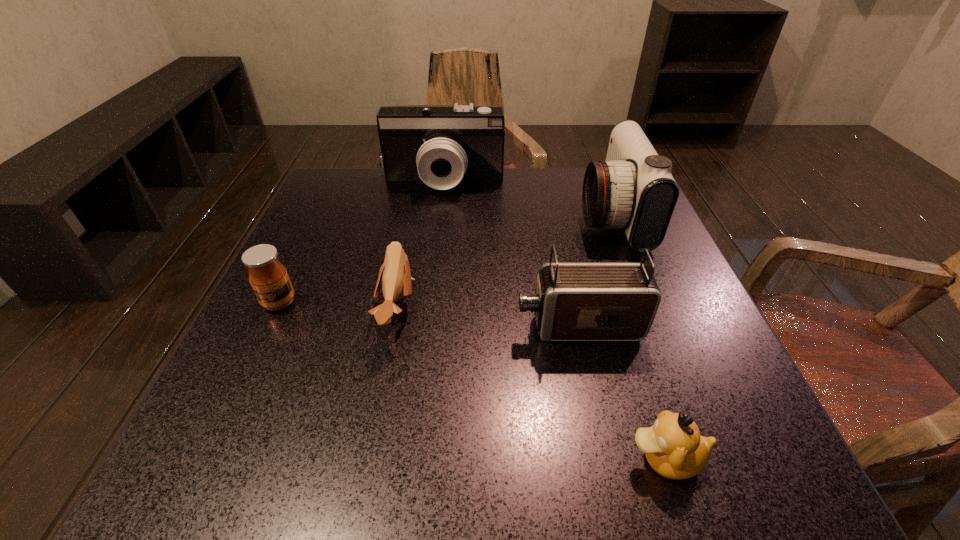
The height and width of the screenshot is (540, 960). Find the location of `object at the near right corner`. object at the near right corner is located at coordinates (673, 446).

Find the location of a particular element. vacant space at the far edge of the desktop is located at coordinates (474, 211).

Locate an element on the screen. The image size is (960, 540). free location at the near edge of the desktop is located at coordinates (627, 455).

The image size is (960, 540). I want to click on free space at the left edge of the desktop, so click(293, 283).

Find the location of `vacant region at the right edge of the desktop`. vacant region at the right edge of the desktop is located at coordinates (647, 363).

Locate an element on the screen. The height and width of the screenshot is (540, 960). free region at the far left corner is located at coordinates (370, 178).

Where is `free point at the near right corner`? This screenshot has width=960, height=540. free point at the near right corner is located at coordinates (720, 433).

Find the location of a particular element. This screenshot has width=960, height=540. free space that is in between the nearest camcorder and the bird is located at coordinates (489, 318).

At what (x,y) coordinates should I click in order to perform the action: click on empty space between the nearest object and the bird. Please return your answer as a coordinate pair (x, y). The width and height of the screenshot is (960, 540). Looking at the image, I should click on (531, 384).

In order to click on free space between the nearest camcorder and the leftmost camcorder in this screenshot , I will do `click(512, 254)`.